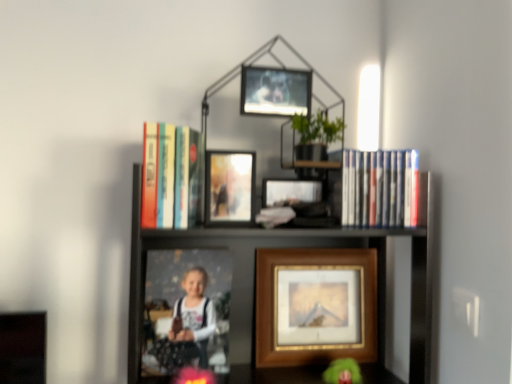
What is the approximate width of matte plastic dvds at upper right, acting as the 2th book starting from the left?

It is 2.23 inches.

Measure the distance between matte plastic dvds at upper right, the 1th book when ordered from right to left, and camera.

matte plastic dvds at upper right, the 1th book when ordered from right to left, is 37.02 inches away from camera.

How much space does wooden framed print at center, which appears as the fourth picture frame when viewed from the top, occupy horizontally?

7.89 centimeters.

This screenshot has height=384, width=512. What do you see at coordinates (275, 91) in the screenshot?
I see `metallic silver picture frame at upper center, the fourth picture frame when ordered from bottom to top` at bounding box center [275, 91].

In order to face hardcover books at upper center, which appears as the first book when viewed from the left, should I rotate leftwards or rightwards?

Turn left by 10.577 degrees to look at hardcover books at upper center, which appears as the first book when viewed from the left.

I want to click on matte plastic photo frame at center, which is counted as the second picture frame, starting from the back, so click(x=186, y=310).

Image resolution: width=512 pixels, height=384 pixels. What are the coordinates of `matte plastic dvds at upper right, acting as the 2th book starting from the left` in the screenshot? It's located at (380, 188).

You are a GUI agent. You are given a task and a screenshot of the screen. Output one action in this format:
    pyautogui.click(x=<x>, y=<y>)
    Task: Click on the book located on the right of hardcover books at upper center, acting as the second book starting from the right
    This screenshot has width=512, height=384.
    Given the screenshot: What is the action you would take?
    pyautogui.click(x=380, y=188)

Is hardcover books at upper center, which appears as the first book when viewed from the left, facing towards matte plastic dvds at upper right, acting as the 2th book starting from the left?

No, hardcover books at upper center, which appears as the first book when viewed from the left, is not oriented towards matte plastic dvds at upper right, acting as the 2th book starting from the left.

Can you confirm if hardcover books at upper center, which appears as the first book when viewed from the left, is positioned to the right of matte plastic dvds at upper right, acting as the 2th book starting from the left?

Incorrect, hardcover books at upper center, which appears as the first book when viewed from the left, is not on the right side of matte plastic dvds at upper right, acting as the 2th book starting from the left.

Looking at this image, is hardcover books at upper center, which appears as the first book when viewed from the left, not near matte plastic dvds at upper right, the 1th book when ordered from right to left?

hardcover books at upper center, which appears as the first book when viewed from the left, is actually quite close to matte plastic dvds at upper right, the 1th book when ordered from right to left.

Locate an element on the screen. The image size is (512, 384). shelf in front of the wooden framed print at center, which is the first picture frame from back to front is located at coordinates (268, 290).

Is point (362, 249) less distant than point (215, 295)?

No.

Would you say wooden framed print at center, which is the first picture frame from back to front, is outside black matte bookshelf at upper center?

No.

Which is closer, (306, 317) or (173, 343)?

Point (173, 343)

In the image, is wooden framed print at center, which is the fourth picture frame from front to back, positioned in front of or behind matte plastic photo frame at center, which is counted as the second picture frame, starting from the back?

wooden framed print at center, which is the fourth picture frame from front to back, is behind matte plastic photo frame at center, which is counted as the second picture frame, starting from the back.

Can you confirm if wooden framed print at center, which is the first picture frame from back to front, is thinner than matte plastic photo frame at center, which is counted as the 3th picture frame, starting from the top?

No.

Between wooden framed print at center, arranged as the 1th picture frame when ordered from the bottom, and matte plastic photo frame at center, the 3th picture frame in the front-to-back sequence, which one has less height?

matte plastic photo frame at center, the 3th picture frame in the front-to-back sequence, is shorter.

Would you consider black matte bookshelf at upper center to be distant from matte plastic photo frame at center, marked as the 2th picture frame in a bottom-to-top arrangement?

No, black matte bookshelf at upper center is not far from matte plastic photo frame at center, marked as the 2th picture frame in a bottom-to-top arrangement.

Which object is positioned more to the left, black matte bookshelf at upper center or matte plastic photo frame at center, the 3th picture frame in the front-to-back sequence?

matte plastic photo frame at center, the 3th picture frame in the front-to-back sequence.

Between black matte bookshelf at upper center and matte plastic photo frame at center, marked as the 2th picture frame in a bottom-to-top arrangement, which one has larger width?

black matte bookshelf at upper center.

From a real-world perspective, between black matte bookshelf at upper center and matte plastic photo frame at center, the 3th picture frame in the front-to-back sequence, who is vertically higher?

In real-world perspective, black matte bookshelf at upper center is above.

Considering the sizes of objects black matte bookshelf at upper center and wooden framed print at center, which is the first picture frame from back to front, in the image provided, who is shorter, black matte bookshelf at upper center or wooden framed print at center, which is the first picture frame from back to front,?

wooden framed print at center, which is the first picture frame from back to front.

From the image's perspective, is black matte bookshelf at upper center on top of wooden framed print at center, which is the fourth picture frame from front to back?

Yes, from the image's perspective, black matte bookshelf at upper center is on top of wooden framed print at center, which is the fourth picture frame from front to back.

Is black matte bookshelf at upper center to the left of wooden framed print at center, which is the first picture frame from back to front, from the viewer's perspective?

Yes.

Between black matte bookshelf at upper center and wooden framed print at center, which is the fourth picture frame from front to back, which one has larger size?

black matte bookshelf at upper center is bigger.

Considering the positions of objects matte plastic dvds at upper right, the 1th book when ordered from right to left, and hardcover books at upper center, which appears as the first book when viewed from the left, in the image provided, who is more to the left, matte plastic dvds at upper right, the 1th book when ordered from right to left, or hardcover books at upper center, which appears as the first book when viewed from the left,?

hardcover books at upper center, which appears as the first book when viewed from the left, is more to the left.

Based on the photo, in the image, is matte plastic dvds at upper right, acting as the 2th book starting from the left, positioned in front of or behind hardcover books at upper center, acting as the second book starting from the right?

In the image, matte plastic dvds at upper right, acting as the 2th book starting from the left, appears behind hardcover books at upper center, acting as the second book starting from the right.

Is matte plastic dvds at upper right, acting as the 2th book starting from the left, taller or shorter than hardcover books at upper center, which appears as the first book when viewed from the left?

matte plastic dvds at upper right, acting as the 2th book starting from the left, is shorter than hardcover books at upper center, which appears as the first book when viewed from the left.

Between matte plastic photo frame at center, marked as the 2th picture frame in a bottom-to-top arrangement, and matte glass picture frame at center, which ranks as the 3th picture frame in bottom-to-top order, which one is positioned behind?

matte plastic photo frame at center, marked as the 2th picture frame in a bottom-to-top arrangement, is more distant.

Considering the sizes of matte plastic photo frame at center, marked as the 2th picture frame in a bottom-to-top arrangement, and matte glass picture frame at center, arranged as the 4th picture frame when viewed from the back, in the image, is matte plastic photo frame at center, marked as the 2th picture frame in a bottom-to-top arrangement, taller or shorter than matte glass picture frame at center, arranged as the 4th picture frame when viewed from the back,?

Considering their sizes, matte plastic photo frame at center, marked as the 2th picture frame in a bottom-to-top arrangement, has more height than matte glass picture frame at center, arranged as the 4th picture frame when viewed from the back.

In the scene shown: Is matte plastic photo frame at center, which is counted as the 3th picture frame, starting from the top, bigger than matte glass picture frame at center, which is the 1th picture frame from front to back?

Indeed, matte plastic photo frame at center, which is counted as the 3th picture frame, starting from the top, has a larger size compared to matte glass picture frame at center, which is the 1th picture frame from front to back.

Would you say matte plastic photo frame at center, which is counted as the second picture frame, starting from the back, is inside or outside matte glass picture frame at center, arranged as the 4th picture frame when viewed from the back?

matte plastic photo frame at center, which is counted as the second picture frame, starting from the back, cannot be found inside matte glass picture frame at center, arranged as the 4th picture frame when viewed from the back.

Locate an element on the screen. The width and height of the screenshot is (512, 384). book in front of the matte plastic dvds at upper right, the 1th book when ordered from right to left is located at coordinates (172, 176).

Where is `shelf on the left of wooden framed print at center, which is the fourth picture frame from front to back`? This screenshot has width=512, height=384. shelf on the left of wooden framed print at center, which is the fourth picture frame from front to back is located at coordinates (268, 290).

Looking at the image, which one is located closer to matte plastic photo frame at center, which is counted as the second picture frame, starting from the back, black matte bookshelf at upper center or wooden framed print at center, which is the first picture frame from back to front?

black matte bookshelf at upper center is closer to matte plastic photo frame at center, which is counted as the second picture frame, starting from the back.

Estimate the real-world distances between objects in this image. Which object is closer to matte glass picture frame at center, which ranks as the 3th picture frame in bottom-to-top order, black matte bookshelf at upper center or wooden framed print at center, which is the fourth picture frame from front to back?

black matte bookshelf at upper center lies closer to matte glass picture frame at center, which ranks as the 3th picture frame in bottom-to-top order, than the other object.

Considering their positions, is wooden framed print at center, which is the fourth picture frame from front to back, positioned further to matte glass picture frame at center, which is the 1th picture frame from front to back, than hardcover books at upper center, which appears as the first book when viewed from the left?

wooden framed print at center, which is the fourth picture frame from front to back, is further to matte glass picture frame at center, which is the 1th picture frame from front to back.

Estimate the real-world distances between objects in this image. Which object is further from hardcover books at upper center, acting as the second book starting from the right, wooden framed print at center, arranged as the 1th picture frame when ordered from the bottom, or matte glass picture frame at center, arranged as the second picture frame when viewed from the top?

Based on the image, wooden framed print at center, arranged as the 1th picture frame when ordered from the bottom, appears to be further to hardcover books at upper center, acting as the second book starting from the right.

Considering their positions, is wooden framed print at center, which is the first picture frame from back to front, positioned further to matte plastic photo frame at center, which is counted as the 3th picture frame, starting from the top, than hardcover books at upper center, acting as the second book starting from the right?

Among the two, hardcover books at upper center, acting as the second book starting from the right, is located further to matte plastic photo frame at center, which is counted as the 3th picture frame, starting from the top.

When comparing their distances from matte plastic dvds at upper right, acting as the 2th book starting from the left, does wooden framed print at center, which is the first picture frame from back to front, or black matte bookshelf at upper center seem closer?

Based on the image, black matte bookshelf at upper center appears to be nearer to matte plastic dvds at upper right, acting as the 2th book starting from the left.

Considering their positions, is metallic silver picture frame at upper center, the fourth picture frame when ordered from bottom to top, positioned further to matte plastic dvds at upper right, the 1th book when ordered from right to left, than black matte bookshelf at upper center?

black matte bookshelf at upper center is further to matte plastic dvds at upper right, the 1th book when ordered from right to left.

Looking at the image, which one is located closer to wooden framed print at center, which appears as the fourth picture frame when viewed from the top, matte glass picture frame at center, arranged as the second picture frame when viewed from the top, or matte plastic dvds at upper right, the 1th book when ordered from right to left?

Among the two, matte plastic dvds at upper right, the 1th book when ordered from right to left, is located nearer to wooden framed print at center, which appears as the fourth picture frame when viewed from the top.

Where is `picture frame between hardcover books at upper center, acting as the second book starting from the right, and black matte bookshelf at upper center, in the vertical direction`? picture frame between hardcover books at upper center, acting as the second book starting from the right, and black matte bookshelf at upper center, in the vertical direction is located at coordinates (229, 188).

The width and height of the screenshot is (512, 384). I want to click on shelf between matte glass picture frame at center, arranged as the second picture frame when viewed from the top, and wooden framed print at center, which is the fourth picture frame from front to back, in the vertical direction, so click(x=268, y=290).

Where is `shelf between matte plastic photo frame at center, which is counted as the second picture frame, starting from the back, and wooden framed print at center, which appears as the fourth picture frame when viewed from the top`? The height and width of the screenshot is (384, 512). shelf between matte plastic photo frame at center, which is counted as the second picture frame, starting from the back, and wooden framed print at center, which appears as the fourth picture frame when viewed from the top is located at coordinates (268, 290).

The image size is (512, 384). In order to click on shelf between matte plastic photo frame at center, which is counted as the 3th picture frame, starting from the top, and matte plastic dvds at upper right, the 1th book when ordered from right to left in this screenshot , I will do `click(268, 290)`.